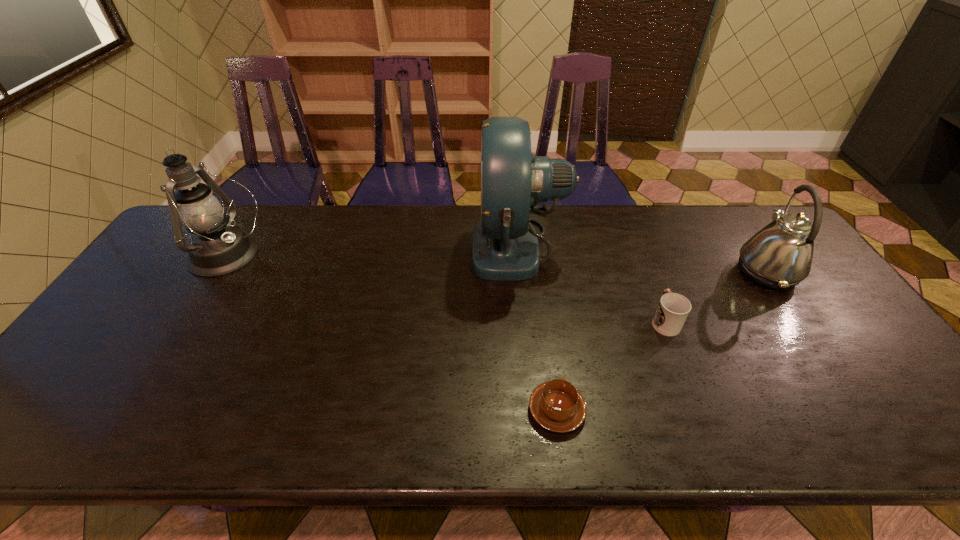
Where is `fan at the far edge`? This screenshot has height=540, width=960. fan at the far edge is located at coordinates (505, 247).

Where is `oil lamp present at the far edge`? The width and height of the screenshot is (960, 540). oil lamp present at the far edge is located at coordinates (217, 248).

Find the location of a particular element. The height and width of the screenshot is (540, 960). kettle that is at the far edge is located at coordinates (779, 256).

The height and width of the screenshot is (540, 960). I want to click on object present at the near edge, so click(x=556, y=405).

Locate an element on the screen. The height and width of the screenshot is (540, 960). object at the left edge is located at coordinates (217, 248).

The image size is (960, 540). Identify the location of object located at the right edge. (779, 256).

Image resolution: width=960 pixels, height=540 pixels. Find the location of `object that is at the far left corner`. object that is at the far left corner is located at coordinates coord(217,248).

Where is `object that is at the far right corner`? object that is at the far right corner is located at coordinates (779, 256).

The width and height of the screenshot is (960, 540). I want to click on vacant space at the far edge of the desktop, so [349, 241].

The image size is (960, 540). Find the location of `vacant space at the near edge`. vacant space at the near edge is located at coordinates click(x=841, y=444).